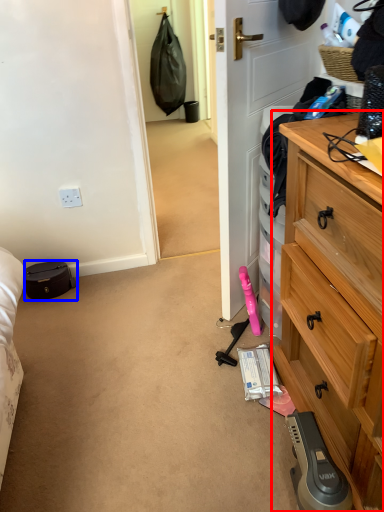
Question: Which point is further to the camera, chest of drawers (highlighted by a red box) or luggage and bags (highlighted by a blue box)?

Choices:
 (A) chest of drawers
 (B) luggage and bags

Answer: (B)